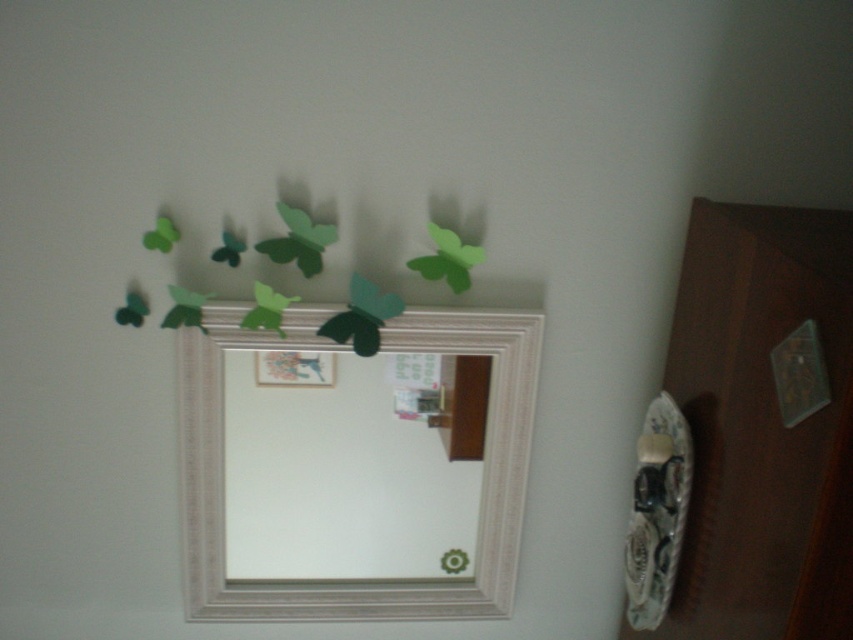
Does wooden dresser at lower right have a greater width compared to white textured picture frame at upper center?

Incorrect, wooden dresser at lower right's width does not surpass white textured picture frame at upper center's.

This screenshot has width=853, height=640. Describe the element at coordinates (761, 428) in the screenshot. I see `wooden dresser at lower right` at that location.

You are a GUI agent. You are given a task and a screenshot of the screen. Output one action in this format:
    pyautogui.click(x=<x>, y=<y>)
    Task: Click on the wooden dresser at lower right
    The width and height of the screenshot is (853, 640).
    Given the screenshot: What is the action you would take?
    pyautogui.click(x=761, y=428)

At what (x,y) coordinates should I click in order to perform the action: click on wooden dresser at lower right. Please return your answer as a coordinate pair (x, y). Looking at the image, I should click on (761, 428).